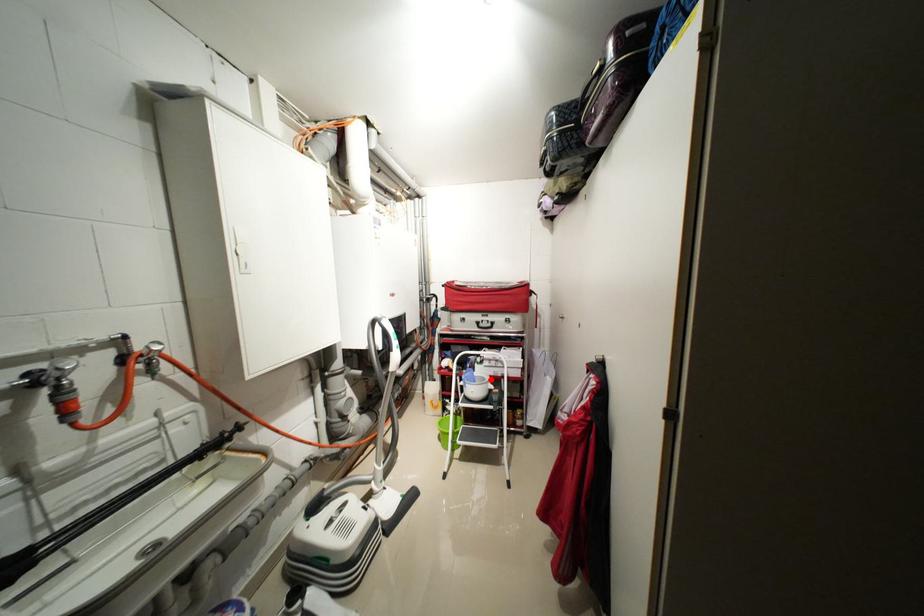
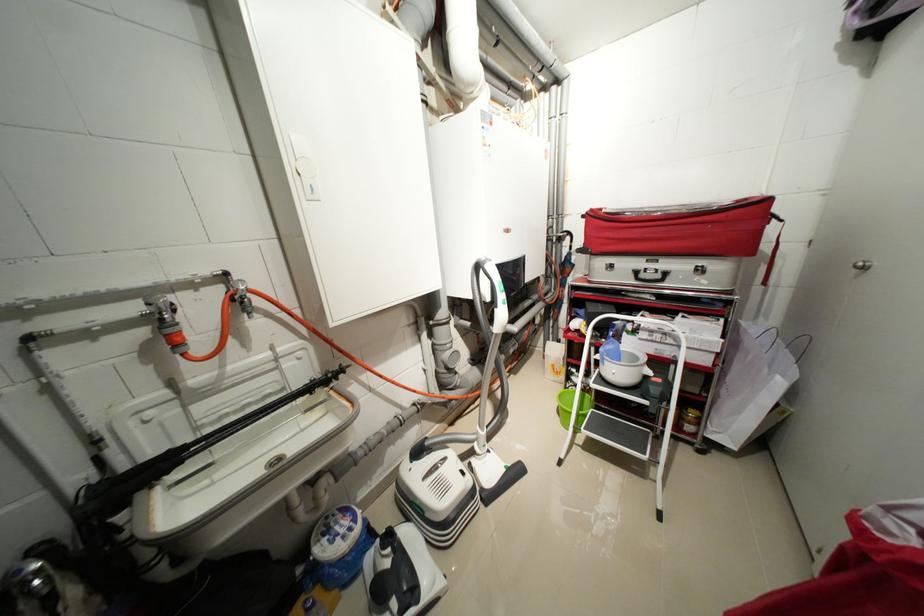
In the second image, find the point that corresponds to the highlighted location in the first image.

(642, 359)